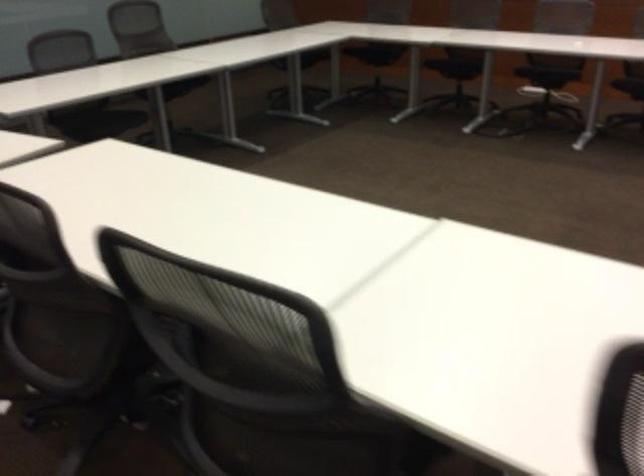
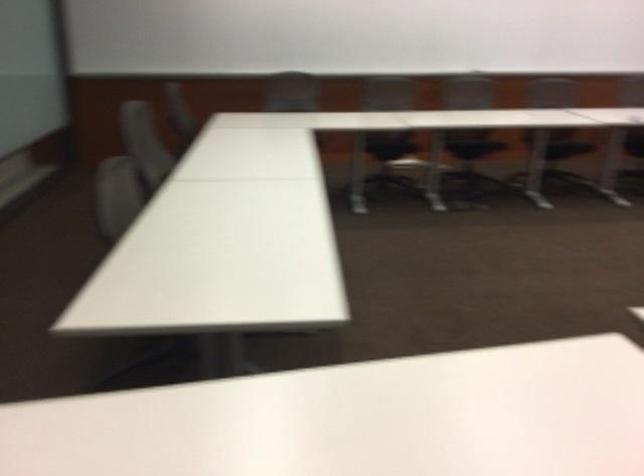
How did the camera likely rotate?

The camera rotated toward right-down.